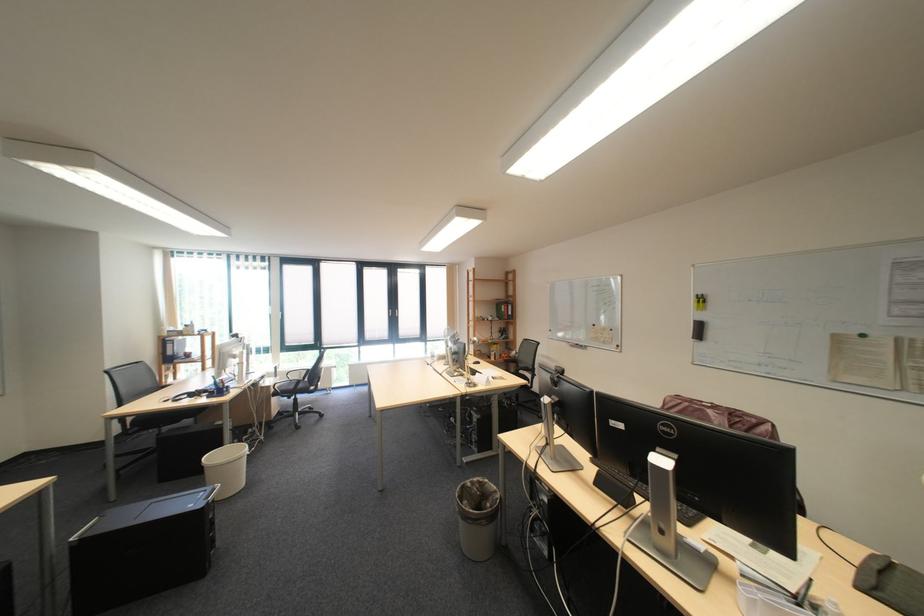
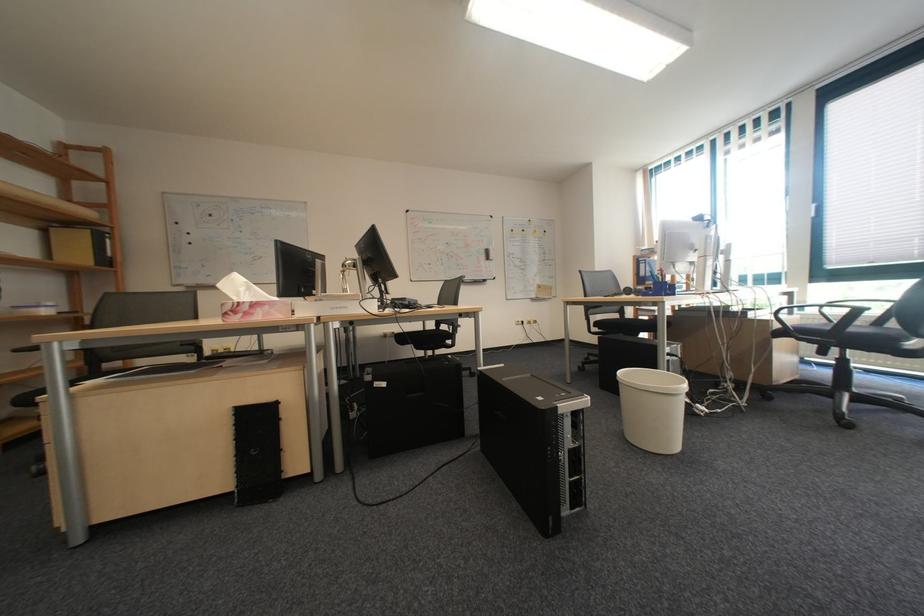
In the second image, find the point that corresponds to point (320, 392) in the first image.

(896, 346)